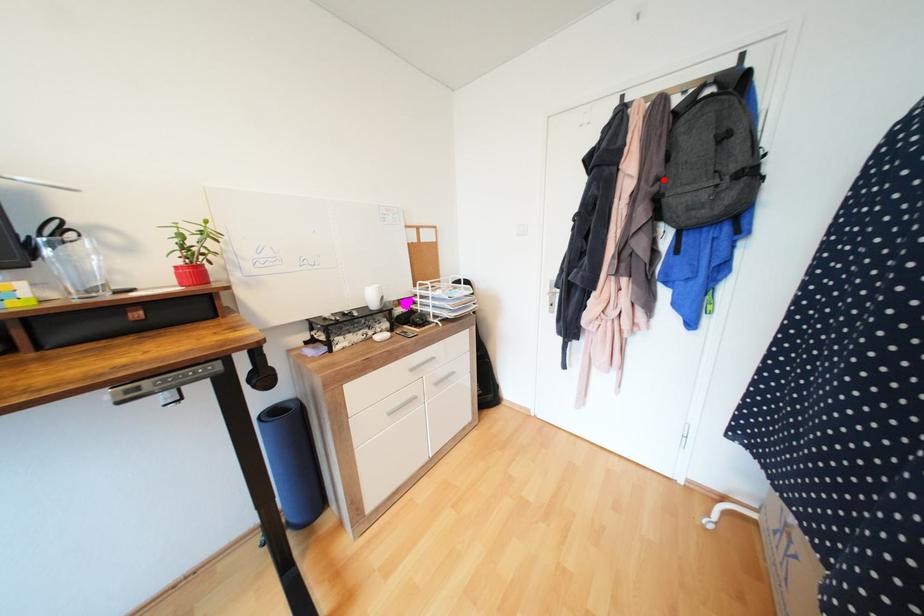
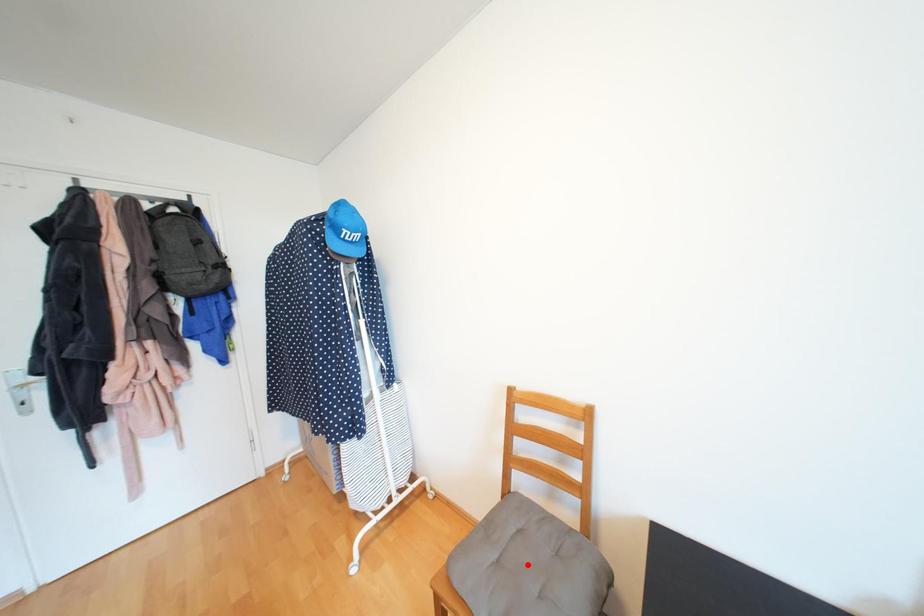
I am providing you with two images of the same scene from different viewpoints. A red point is marked on the first image and another point is marked on the second image. Is the marked point in image1 the same physical position as the marked point in image2?

No